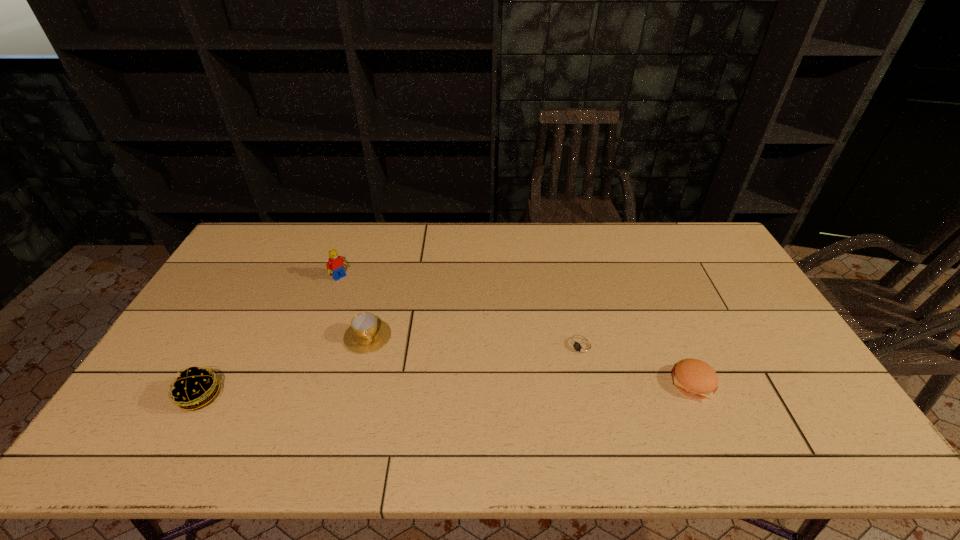
At what (x,y) coordinates should I click in order to perform the action: click on vacant area that lies between the farthest object and the taller patty. Please return your answer as a coordinate pair (x, y). This screenshot has width=960, height=540. Looking at the image, I should click on (270, 337).

Locate an element on the screen. vacant area between the Lego and the leftmost object is located at coordinates (270, 337).

What are the coordinates of `free space that is in between the cup and the watch` in the screenshot? It's located at (475, 342).

Find the location of a particular element. The height and width of the screenshot is (540, 960). vacant area between the farthest object and the watch is located at coordinates (461, 312).

The width and height of the screenshot is (960, 540). I want to click on vacant space in between the second tallest object and the third object from left to right, so click(x=284, y=367).

At what (x,y) coordinates should I click in order to perform the action: click on empty location between the fourth object from left to right and the farthest object. Please return your answer as a coordinate pair (x, y). The height and width of the screenshot is (540, 960). Looking at the image, I should click on (461, 312).

Locate an element on the screen. Image resolution: width=960 pixels, height=540 pixels. free space between the right patty and the taller patty is located at coordinates (447, 390).

Locate which object ranks third in proximity to the shorter patty. Please provide its 2D coordinates. Your answer should be formatted as a tuple, i.e. [(x, y)], where the tuple contains the x and y coordinates of a point satisfying the conditions above.

[(335, 265)]

Locate which object ranks second in proximity to the fourth object from right to left. Please provide its 2D coordinates. Your answer should be formatted as a tuple, i.e. [(x, y)], where the tuple contains the x and y coordinates of a point satisfying the conditions above.

[(194, 388)]

Where is `vacant position in the image that satisfies the following two spatial constraints: 1. on the back side of the shortest object; 2. on the right side of the fourth shortest object`? Image resolution: width=960 pixels, height=540 pixels. vacant position in the image that satisfies the following two spatial constraints: 1. on the back side of the shortest object; 2. on the right side of the fourth shortest object is located at coordinates (228, 347).